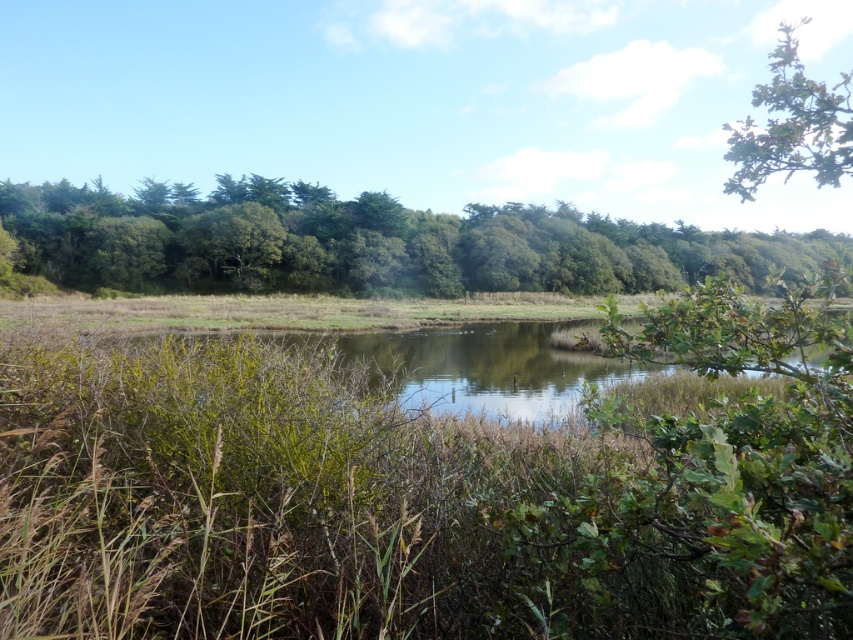
Does green leafy trees at center have a greater height compared to green leafy tree at upper right?

No, green leafy trees at center is not taller than green leafy tree at upper right.

Can you confirm if green leafy trees at center is smaller than green leafy tree at upper right?

Indeed, green leafy trees at center has a smaller size compared to green leafy tree at upper right.

Does point (167, 282) come farther from viewer compared to point (805, 112)?

That is True.

At what (x,y) coordinates should I click in order to perform the action: click on green leafy trees at center. Please return your answer as a coordinate pair (x, y). Image resolution: width=853 pixels, height=640 pixels. Looking at the image, I should click on (369, 243).